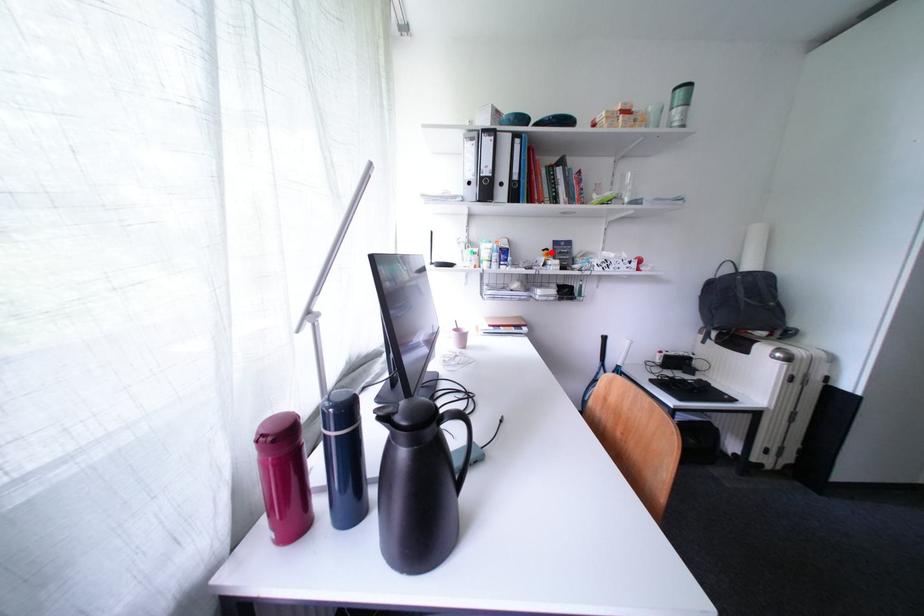
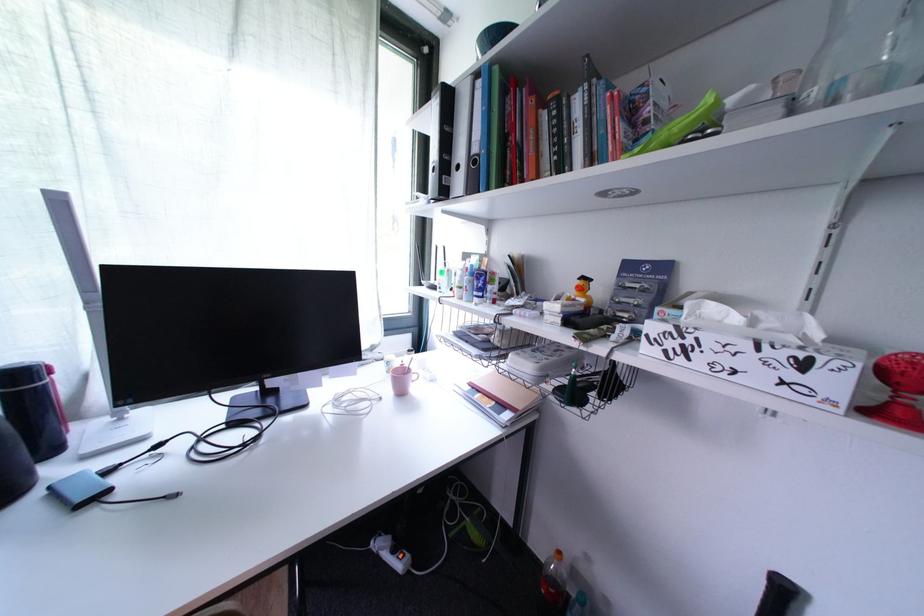
Where in the second image is the point corresponding to the highlighted location from the first image?

(588, 282)